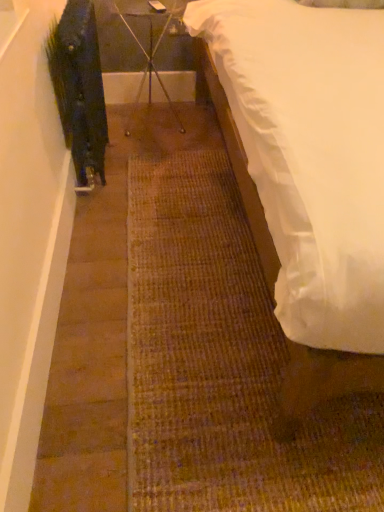
Question: Based on their sizes in the image, would you say metal tripod at center is bigger or smaller than white satin bed at right?

Choices:
 (A) big
 (B) small

Answer: (B)

Question: Considering the positions of metal tripod at center and white satin bed at right in the image, is metal tripod at center taller or shorter than white satin bed at right?

Choices:
 (A) short
 (B) tall

Answer: (A)

Question: Considering the real-world distances, which object is closest to the green matte plant at left?

Choices:
 (A) white satin bed at right
 (B) metal tripod at center

Answer: (B)

Question: Considering the real-world distances, which object is closest to the green matte plant at left?

Choices:
 (A) metal tripod at center
 (B) white satin bed at right

Answer: (A)